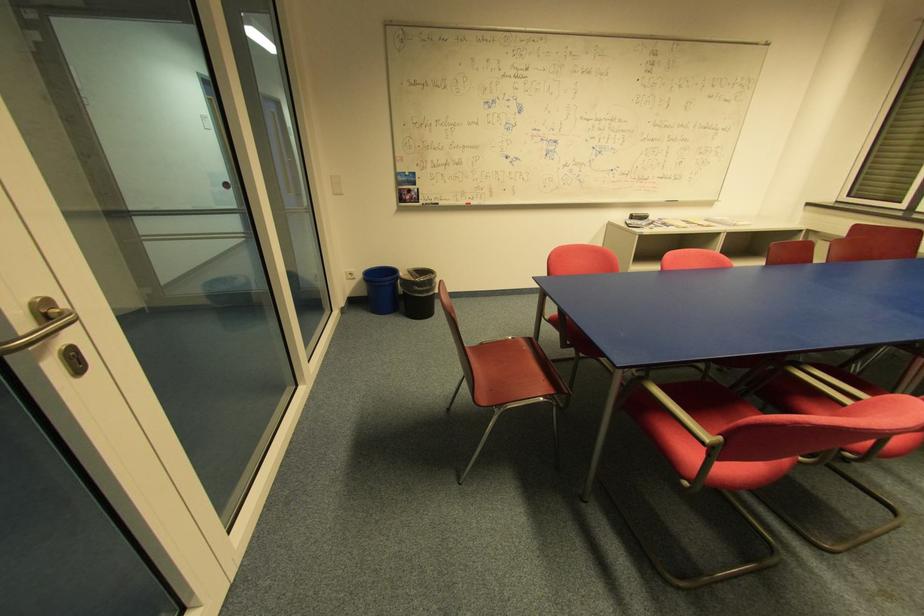
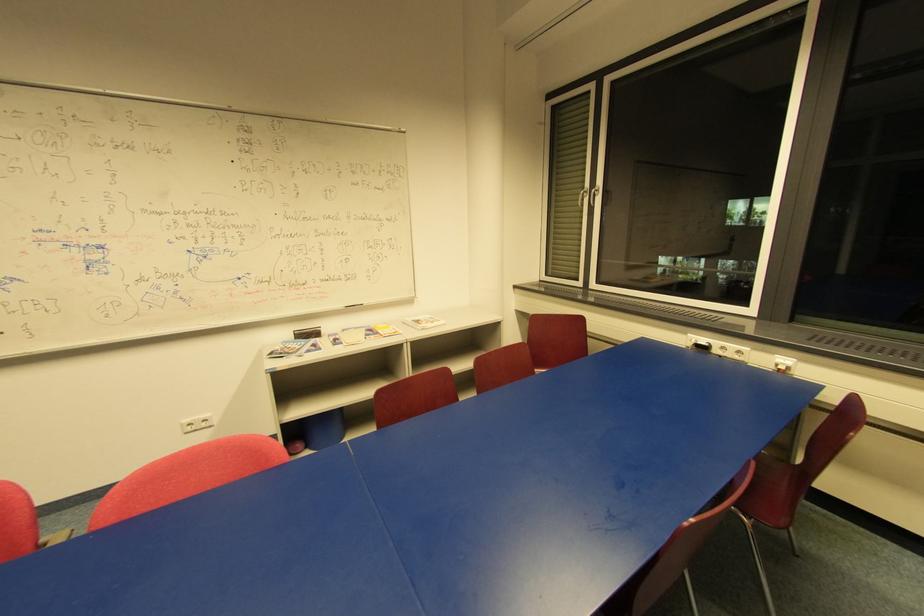
In a continuous first-person perspective shot, in which direction is the camera moving?

The cameraman walked toward right, forward.